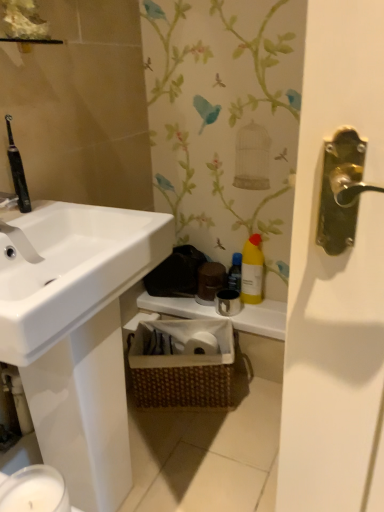
Find the location of a particular element. vacant space that is to the left of yellow matte bottle at center is located at coordinates (194, 301).